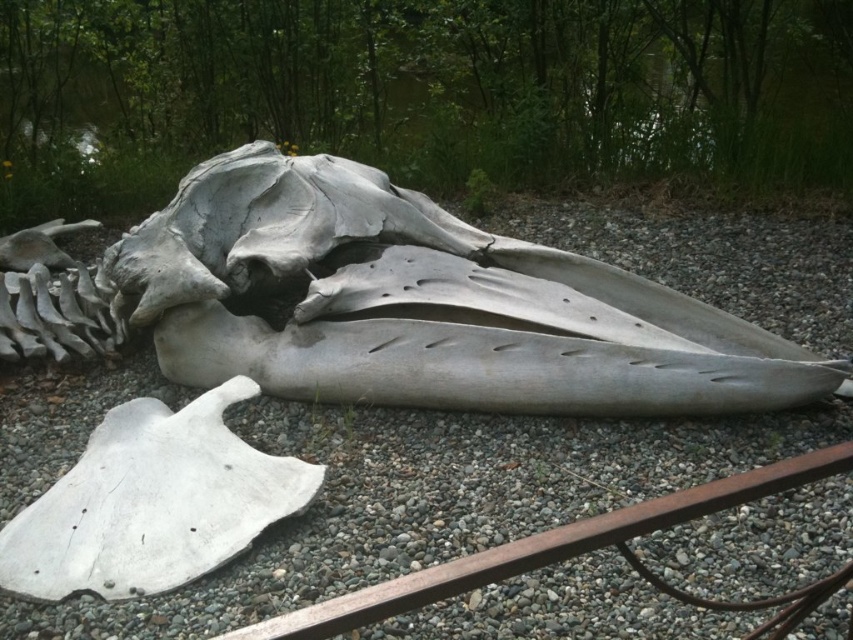
You are a geologist examining the gray gravel at center and the gray matte skull at center. Which object is taller?

The gray matte skull at center is taller than the gray gravel at center.

Consider the image. You are standing at the center of the image. Which direction should you move to avoid stepping on the gray gravel at center?

Since the gray gravel at center is located at point (427, 500), moving away from that coordinate would avoid stepping on it. For example, moving north, south, east, or west away from the center point would work.

You are a paleontologist examining the whale skeleton. You notice the gray gravel at center and the gray matte skull at center. Which object is located below the other?

The gray gravel at center is positioned under the gray matte skull at center, so the gravel is below the skull.